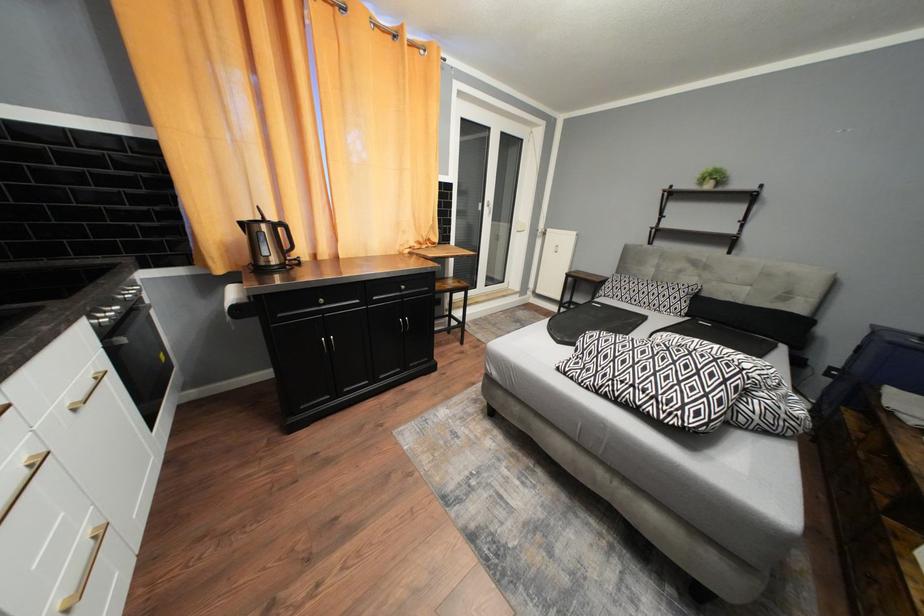
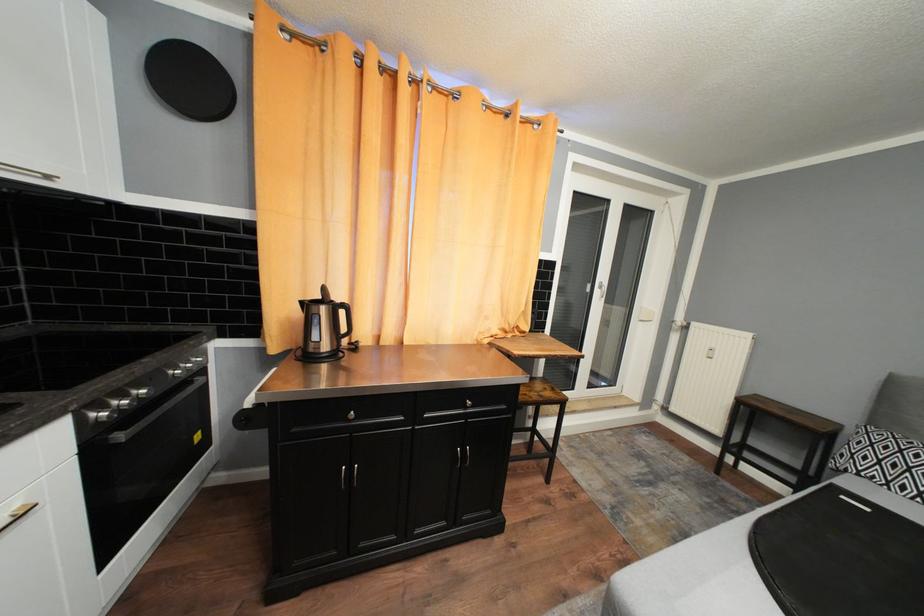
Question: The camera is either moving clockwise (left) or counter-clockwise (right) around the object. The first image is from the beginning of the video and the second image is from the end. Is the camera moving left or right when shooting the video?

Choices:
 (A) Left
 (B) Right

Answer: (B)